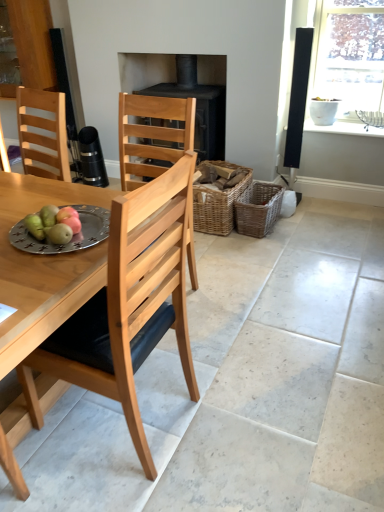
Find the location of a particular element. free space behind silver metallic plate at table left is located at coordinates (68, 201).